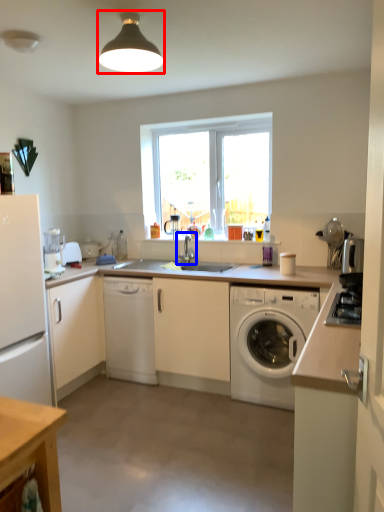
Question: Which of the following is the farthest to the observer, light fixture (highlighted by a red box) or tap (highlighted by a blue box)?

Choices:
 (A) light fixture
 (B) tap

Answer: (B)